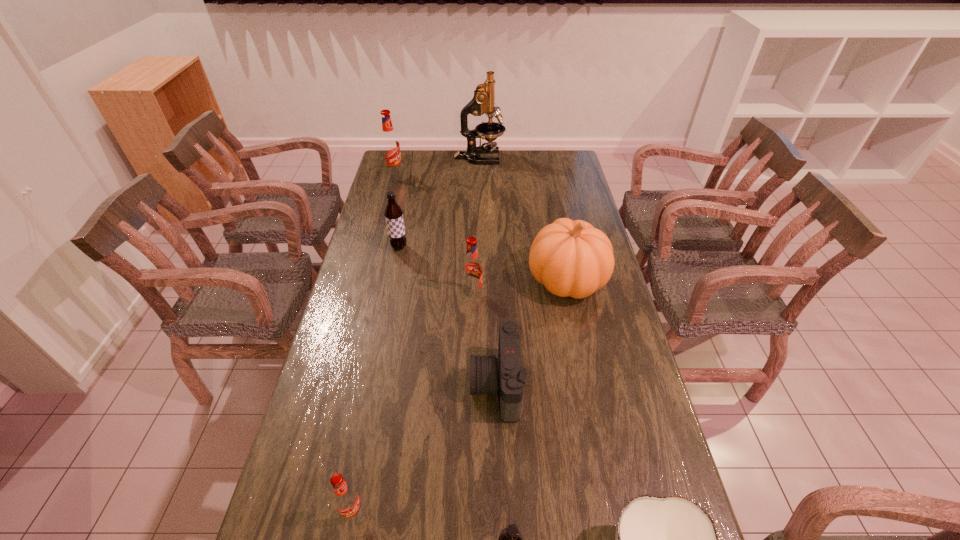
At what (x,y) coordinates should I click in order to perform the action: click on the second red root beer from left to right. Please return your answer as a coordinate pair (x, y). This screenshot has height=540, width=960. Looking at the image, I should click on (346, 499).

I want to click on the sixth farthest object, so click(504, 374).

Identify the location of vacant space positioned at the eyepiece of the tallest object. (564, 158).

Find the location of a particular element. The width and height of the screenshot is (960, 540). free location located 0.180m on the right of the farthest root beer is located at coordinates (442, 173).

Find the location of a particular element. The height and width of the screenshot is (540, 960). vacant space located on the back of the pumpkin is located at coordinates (555, 221).

Image resolution: width=960 pixels, height=540 pixels. I want to click on free space located 0.300m on the back of the second farthest red root beer, so click(473, 233).

Find the location of a particular element. This screenshot has width=960, height=540. vacant space located 0.070m on the back of the left brown root beer is located at coordinates (402, 230).

Find the location of `free region located 0.230m on the right of the nearest red root beer`. free region located 0.230m on the right of the nearest red root beer is located at coordinates (466, 512).

Find the location of `vacant area located 0.390m at the lens of the camera`. vacant area located 0.390m at the lens of the camera is located at coordinates (332, 385).

You are a GUI agent. You are given a task and a screenshot of the screen. Output one action in this format:
    pyautogui.click(x=<x>, y=<y>)
    Task: Click on the blank space located 0.350m at the lens of the camera
    Image resolution: width=960 pixels, height=540 pixels.
    Given the screenshot: What is the action you would take?
    pyautogui.click(x=346, y=385)